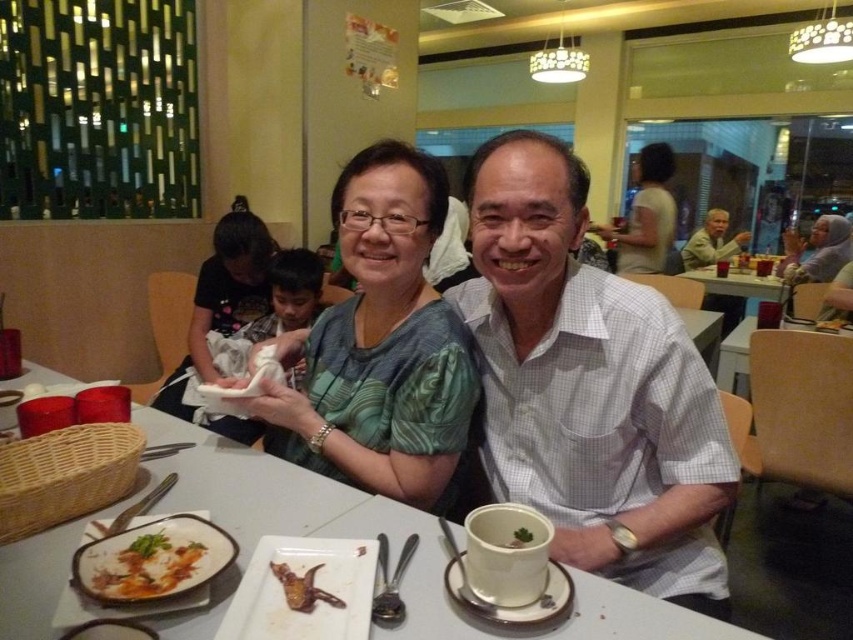
Does white glossy plate at lower left come in front of brown crispy scorpion at center?

Yes, it is in front of brown crispy scorpion at center.

Is point (194, 556) farther from viewer compared to point (289, 577)?

Yes.

This screenshot has height=640, width=853. I want to click on white glossy plate at lower left, so click(x=148, y=566).

Can you confirm if white paper plate at lower center is bigger than white ceramic plate at center?

Yes, white paper plate at lower center is bigger than white ceramic plate at center.

Which is in front, point (254, 592) or point (453, 602)?

Point (254, 592)

Locate an element on the screen. This screenshot has height=640, width=853. white paper plate at lower center is located at coordinates (312, 582).

Can you confirm if white ceramic plate at center is positioned above brown crispy scorpion at center?

Actually, white ceramic plate at center is below brown crispy scorpion at center.

Is white ceramic plate at center to the right of brown crispy scorpion at center from the viewer's perspective?

Indeed, white ceramic plate at center is positioned on the right side of brown crispy scorpion at center.

In the scene shown: Who is more distant from viewer, (560, 580) or (287, 577)?

The point (560, 580) is behind.

Locate an element on the screen. The image size is (853, 640). white ceramic plate at center is located at coordinates (519, 605).